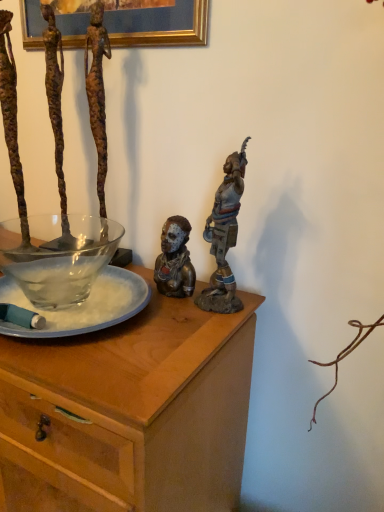
I want to click on free spot to the right of rusty metal figure at upper left, acting as the first person starting from the left, so click(145, 269).